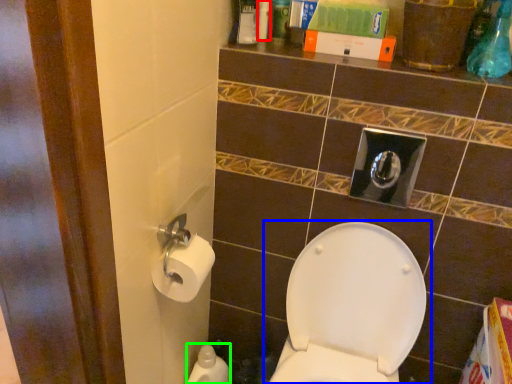
Question: Which object is positioned closest to toiletry (highlighted by a red box)? Select from toilet (highlighted by a blue box) and cleaning product (highlighted by a green box).

Choices:
 (A) toilet
 (B) cleaning product

Answer: (A)